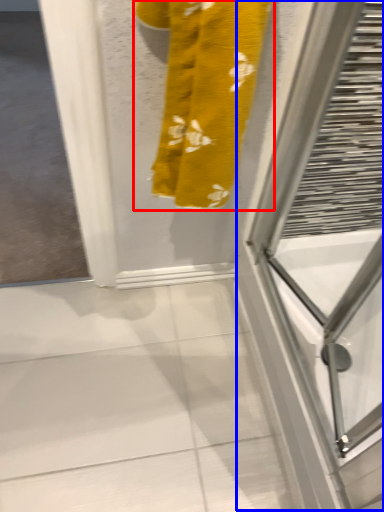
Question: Which object appears farthest to the camera in this image, towel (highlighted by a red box) or screen door (highlighted by a blue box)?

Choices:
 (A) towel
 (B) screen door

Answer: (B)